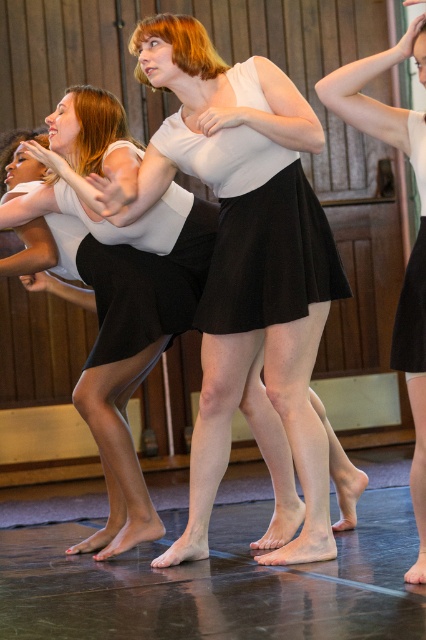
You are a photographer in the dance studio and want to capture a clear shot of the white matte skirt at center and the black pleated skirt at center. Which skirt will appear closer to the camera in your photo?

The white matte skirt at center will appear closer to the camera because it is in front of the black pleated skirt at center.

You are a photographer in the dance studio and want to capture the dancer with the black pleated skirt at center and the black satin skirt at center. Which skirt is positioned higher on the dancer?

The black pleated skirt at center is above the black satin skirt at center, so the black pleated skirt at center is positioned higher on the dancer.